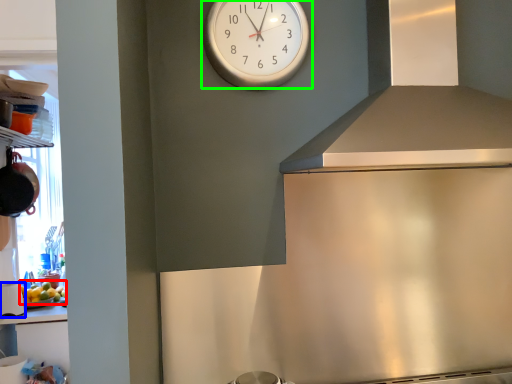
Question: Which object is the closest to the food (highlighted by a red box)? Choose among these: appliance (highlighted by a blue box) or wall clock (highlighted by a green box).

Choices:
 (A) appliance
 (B) wall clock

Answer: (A)